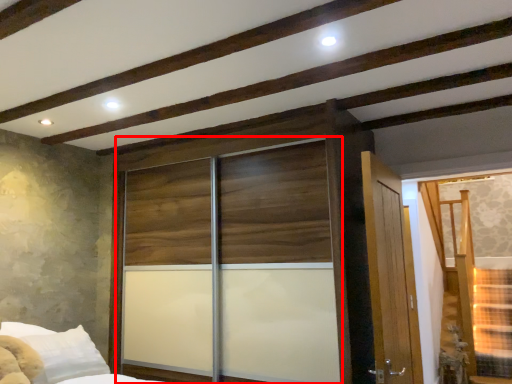
Question: From the image's perspective, where is screen door (annotated by the red box) located relative to window?

Choices:
 (A) above
 (B) below

Answer: (B)